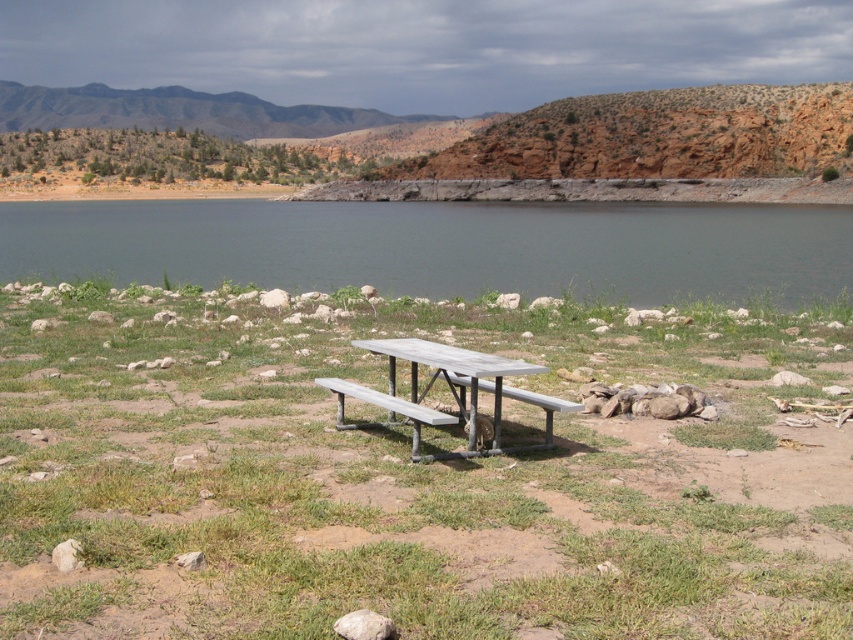
Measure the distance between green grass at center and camera.

The distance of green grass at center from camera is 4.35 meters.

Between green grass at center and metallic silver park bench at center, which one is positioned higher?

green grass at center is higher up.

Who is more forward, (154, 600) or (509, 396)?

Point (154, 600) is more forward.

Identify the location of green grass at center. (412, 483).

Can you confirm if wooden picnic table at center is positioned below gray metallic bench at center?

Actually, wooden picnic table at center is above gray metallic bench at center.

Does wooden picnic table at center appear over gray metallic bench at center?

Indeed, wooden picnic table at center is positioned over gray metallic bench at center.

Does point (463, 360) come farther from viewer compared to point (428, 456)?

No, (463, 360) is closer to viewer.

The width and height of the screenshot is (853, 640). I want to click on wooden picnic table at center, so (451, 368).

Find the location of a particular element. The image size is (853, 640). wooden picnic table at center is located at coordinates (451, 368).

Can you confirm if wooden picnic table at center is positioned above metallic silver park bench at center?

Yes.

Is point (415, 400) positioned after point (560, 406)?

That is True.

The height and width of the screenshot is (640, 853). I want to click on wooden picnic table at center, so click(451, 368).